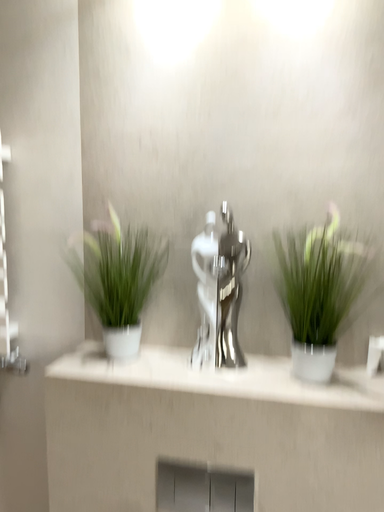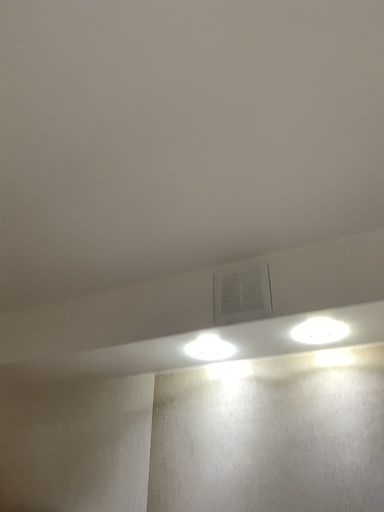
Question: How did the camera likely rotate when shooting the video?

Choices:
 (A) rotated right
 (B) rotated left

Answer: (B)